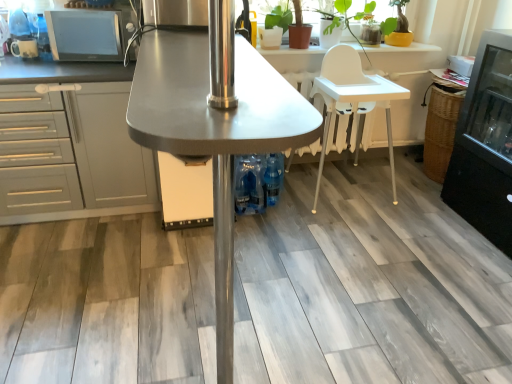
Locate an element on the screen. The width and height of the screenshot is (512, 384). vacant area that lies between white plastic chair at center and metallic gray table at center, which ranks as the second table in back-to-front order is located at coordinates (314, 262).